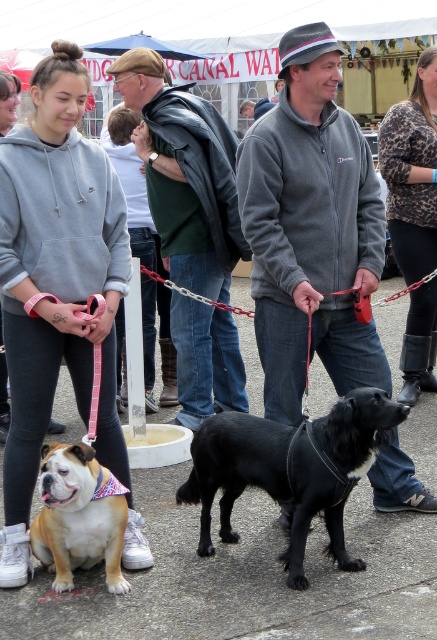
Is gray fleece jacket at center to the left of gray sweatshirt at upper left from the viewer's perspective?

In fact, gray fleece jacket at center is to the right of gray sweatshirt at upper left.

Which of these two, gray fleece jacket at center or gray sweatshirt at upper left, stands taller?

gray sweatshirt at upper left is taller.

Between point (332, 77) and point (83, 168), which one is positioned behind?

Positioned behind is point (332, 77).

Locate an element on the screen. This screenshot has height=640, width=437. gray fleece jacket at center is located at coordinates (311, 228).

Does dark gray fleece at center have a greater width compared to black smooth dog at center?

Incorrect, dark gray fleece at center's width does not surpass black smooth dog at center's.

Locate an element on the screen. dark gray fleece at center is located at coordinates (183, 176).

Can you confirm if gray fleece jacket at center is positioned to the right of black smooth dog at center?

Indeed, gray fleece jacket at center is positioned on the right side of black smooth dog at center.

Does point (366, 369) lie in front of point (374, 435)?

No, (366, 369) is further to viewer.

Does point (374, 257) come closer to viewer compared to point (291, 429)?

No, (374, 257) is further to viewer.

I want to click on gray fleece jacket at center, so click(311, 228).